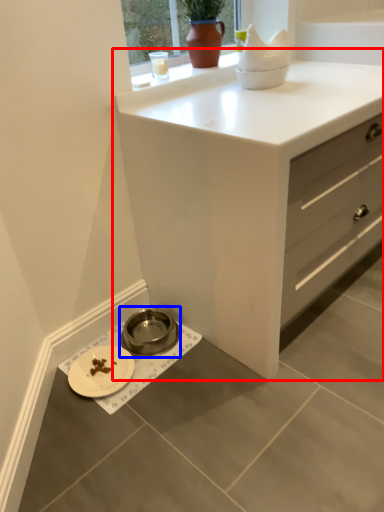
Question: Which object appears farthest to the camera in this image, chest of drawers (highlighted by a red box) or appliance (highlighted by a blue box)?

Choices:
 (A) chest of drawers
 (B) appliance

Answer: (B)